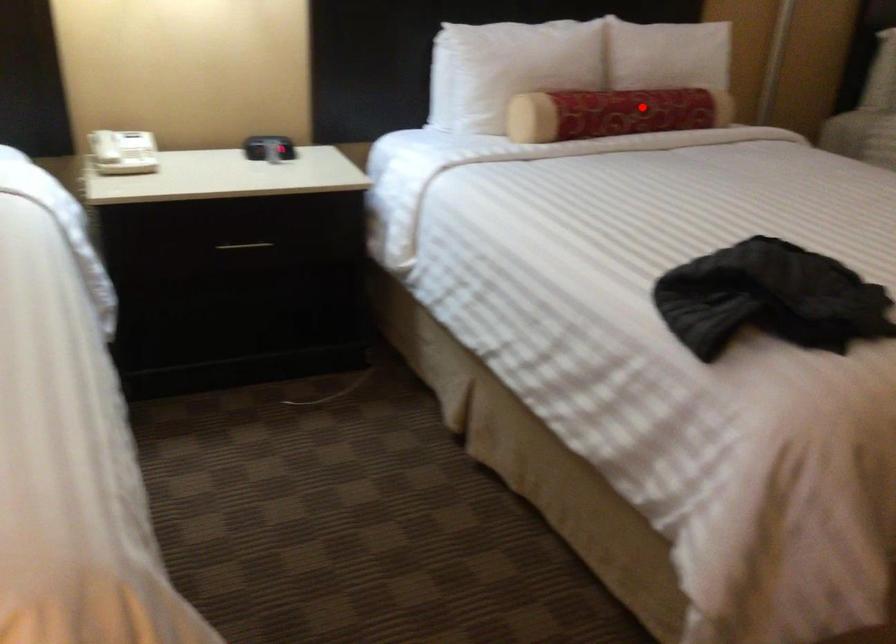
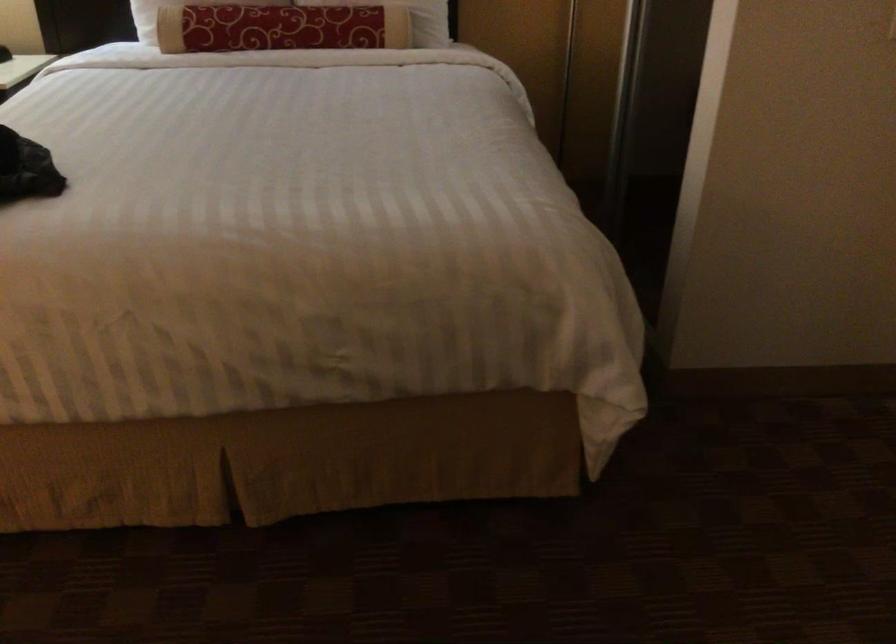
Where in the second image is the point corresponding to the highlighted location from the first image?

(280, 28)